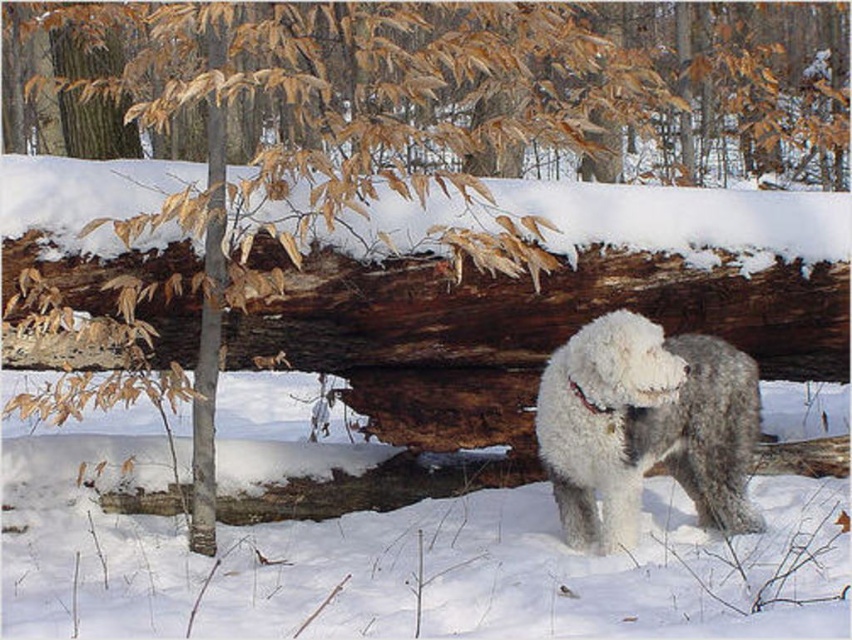
You are a photographer trying to capture a closeup of the rough bark log at center and the white fluffy dog at center in the winter forest scene. Given that your camera can focus on objects within a 30 inch range, will you be able to get both subjects in focus at the same time?

The rough bark log at center and white fluffy dog at center are 33.34 inches apart from each other. Since the distance between them exceeds the camera focus range of 30 inches, you won exceed the camera focus range of 30 inches, you will not be able to get both subjects in focus at the same time.

In the scene shown: You are a photographer trying to capture the rough bark log at center and the white fluffy dog at center in the same frame. Given that the camera can only focus on objects within a 1.5 meter width, will both fit in the frame?

The rough bark log at center is wider than the white fluffy dog at center. Since the camera can only focus on objects within a 1.5 meter width, if the log exceeds this width, it might not fit entirely. However, the question does not provide exact measurements, so we cannot confirm. Please check the actual dimensions.

You are a photographer planning to take a picture of the rough bark log at center and the white fluffy dog at center in the winter forest scene. Since you want both subjects to be clearly visible in the frame, which subject should you focus on first to ensure proper depth of field?

The rough bark log at center is larger than the white fluffy dog at center, so focusing on the log first will help ensure both are in focus due to its larger size occupying more of the frame.